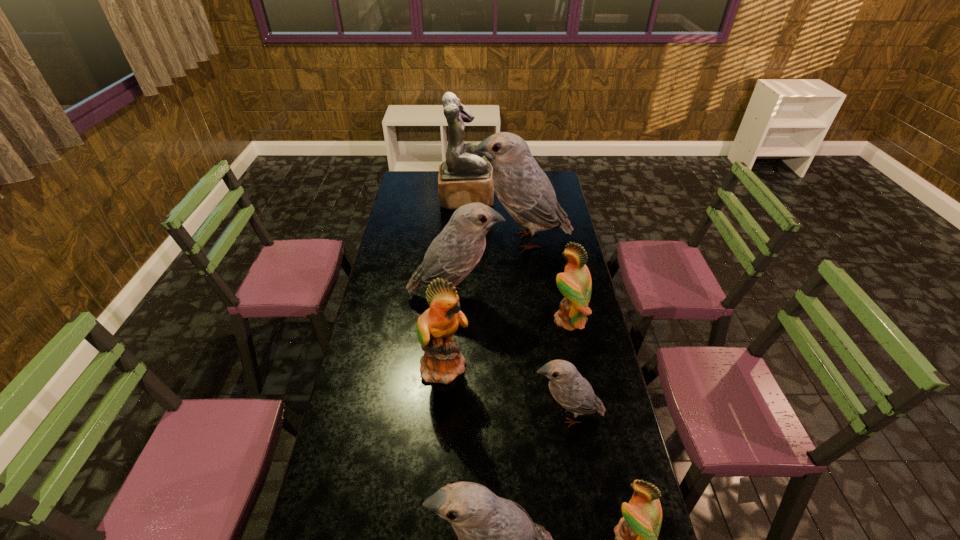
Where is `vacant space located 0.220m on the front-facing side of the biggest gray parrot`? vacant space located 0.220m on the front-facing side of the biggest gray parrot is located at coordinates (427, 241).

The width and height of the screenshot is (960, 540). In order to click on free space located on the front-facing side of the biggest gray parrot in this screenshot , I will do `click(429, 241)`.

Image resolution: width=960 pixels, height=540 pixels. Identify the location of blank space located 0.110m on the front-facing side of the biggest gray parrot. (450, 241).

You are a GUI agent. You are given a task and a screenshot of the screen. Output one action in this format:
    pyautogui.click(x=<x>, y=<y>)
    Task: Click on the vacant region located 0.170m on the front-facing side of the third smallest gray parrot
    The image size is (960, 540).
    Given the screenshot: What is the action you would take?
    pyautogui.click(x=543, y=297)

The width and height of the screenshot is (960, 540). In order to click on vacant space located on the front-facing side of the fourth nearest object in this screenshot , I will do `click(576, 366)`.

Find the location of a particular element. Image resolution: width=960 pixels, height=540 pixels. vacant space located 0.250m on the front-facing side of the second biggest green parrot is located at coordinates (488, 320).

Where is `free space located 0.200m on the front-facing side of the second biggest green parrot`? The width and height of the screenshot is (960, 540). free space located 0.200m on the front-facing side of the second biggest green parrot is located at coordinates (500, 320).

What are the coordinates of `free space located 0.330m on the front-facing side of the second biggest green parrot` in the screenshot? It's located at (468, 320).

What are the coordinates of `free space located 0.150m on the front-facing side of the third farthest gray parrot` in the screenshot? It's located at (484, 415).

Where is `vacant area situated on the front-facing side of the third farthest gray parrot`? The image size is (960, 540). vacant area situated on the front-facing side of the third farthest gray parrot is located at coordinates (491, 415).